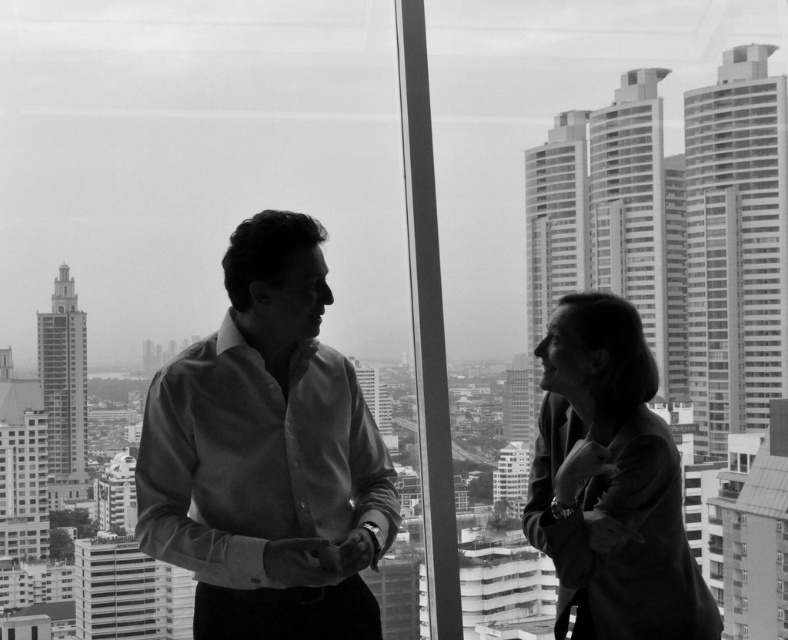
Question: Is matte white shirt at center smaller than smooth black blazer at right?

Choices:
 (A) yes
 (B) no

Answer: (B)

Question: Which object is the closest to the matte white shirt at center?

Choices:
 (A) smooth shirt at center
 (B) smooth black blazer at right

Answer: (A)

Question: Can you confirm if matte white shirt at center is positioned below smooth black blazer at right?

Choices:
 (A) yes
 (B) no

Answer: (B)

Question: Among these objects, which one is farthest from the camera?

Choices:
 (A) matte white shirt at center
 (B) smooth black blazer at right

Answer: (B)

Question: Which object is positioned farthest from the matte white shirt at center?

Choices:
 (A) smooth shirt at center
 (B) smooth black blazer at right

Answer: (B)

Question: Does smooth shirt at center appear on the right side of smooth black blazer at right?

Choices:
 (A) no
 (B) yes

Answer: (A)